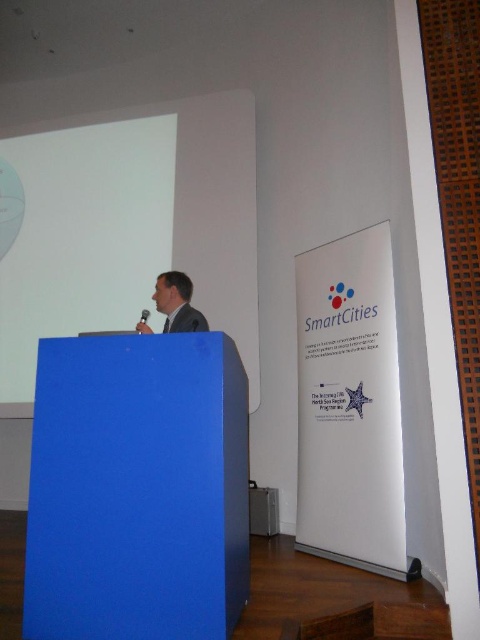
Question: Estimate the real-world distances between objects in this image. Which object is closer to the blue suit at center?

Choices:
 (A) dark gray suit at center
 (B) white matte projection screen at upper center

Answer: (A)

Question: Is white matte projection screen at upper center to the right of blue suit at center from the viewer's perspective?

Choices:
 (A) yes
 (B) no

Answer: (B)

Question: Which point appears closest to the camera in this image?

Choices:
 (A) (170, 305)
 (B) (180, 321)
 (C) (171, 241)

Answer: (B)

Question: Can you confirm if blue suit at center is smaller than dark gray suit at center?

Choices:
 (A) no
 (B) yes

Answer: (A)

Question: Which point is farther to the camera?

Choices:
 (A) (167, 316)
 (B) (56, 180)
 (C) (173, 282)

Answer: (B)

Question: Is white matte projection screen at upper center above blue suit at center?

Choices:
 (A) no
 (B) yes

Answer: (B)